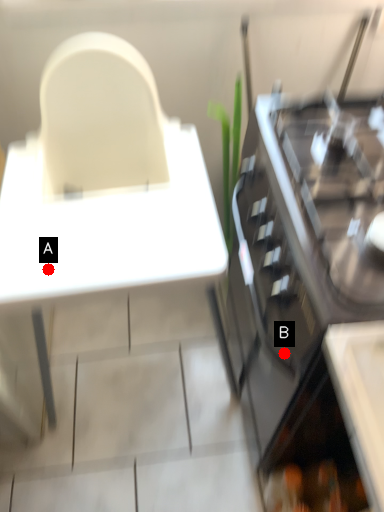
Question: Two points are circled on the image, labeled by A and B beside each circle. Among these points, which one is nearest to the camera?

Choices:
 (A) A is closer
 (B) B is closer

Answer: (B)